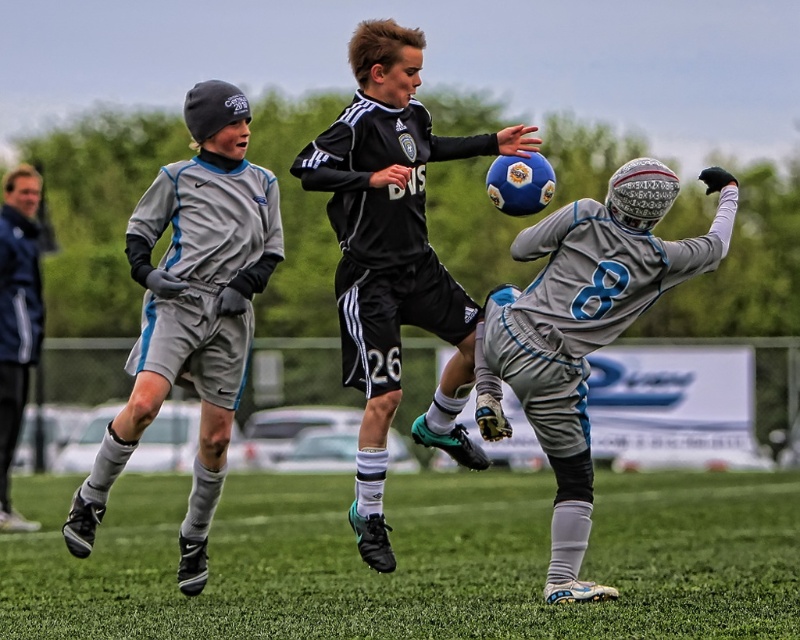
Can you confirm if black matte soccer ball at center is thinner than gray matte soccer uniform at left?

Incorrect, black matte soccer ball at center's width is not less than gray matte soccer uniform at left's.

Between black matte soccer ball at center and gray matte soccer uniform at left, which one appears on the right side from the viewer's perspective?

Positioned to the right is black matte soccer ball at center.

Image resolution: width=800 pixels, height=640 pixels. What do you see at coordinates (393, 259) in the screenshot?
I see `black matte soccer ball at center` at bounding box center [393, 259].

Image resolution: width=800 pixels, height=640 pixels. I want to click on black matte soccer ball at center, so click(x=393, y=259).

From the picture: Is green grass at center behind dark blue jacket at left?

No, it is not.

Can you confirm if green grass at center is thinner than dark blue jacket at left?

In fact, green grass at center might be wider than dark blue jacket at left.

The width and height of the screenshot is (800, 640). What are the coordinates of `green grass at center` in the screenshot? It's located at (414, 561).

Locate an element on the screen. The height and width of the screenshot is (640, 800). green grass at center is located at coordinates (414, 561).

Which is more to the left, black matte soccer ball at center or gray matte soccer jersey at center?

black matte soccer ball at center is more to the left.

Is point (381, 337) farther from viewer compared to point (717, 244)?

No, it is in front of (717, 244).

What do you see at coordinates (393, 259) in the screenshot?
I see `black matte soccer ball at center` at bounding box center [393, 259].

Locate an element on the screen. This screenshot has height=640, width=800. black matte soccer ball at center is located at coordinates (393, 259).